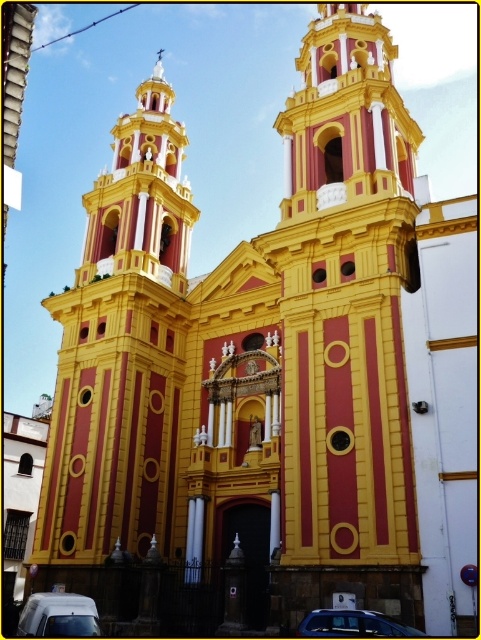
Can you confirm if white matte van at lower left is wider than metallic blue car at lower center?

Yes, white matte van at lower left is wider than metallic blue car at lower center.

This screenshot has width=481, height=640. Find the location of `white matte van at lower left`. white matte van at lower left is located at coordinates (59, 616).